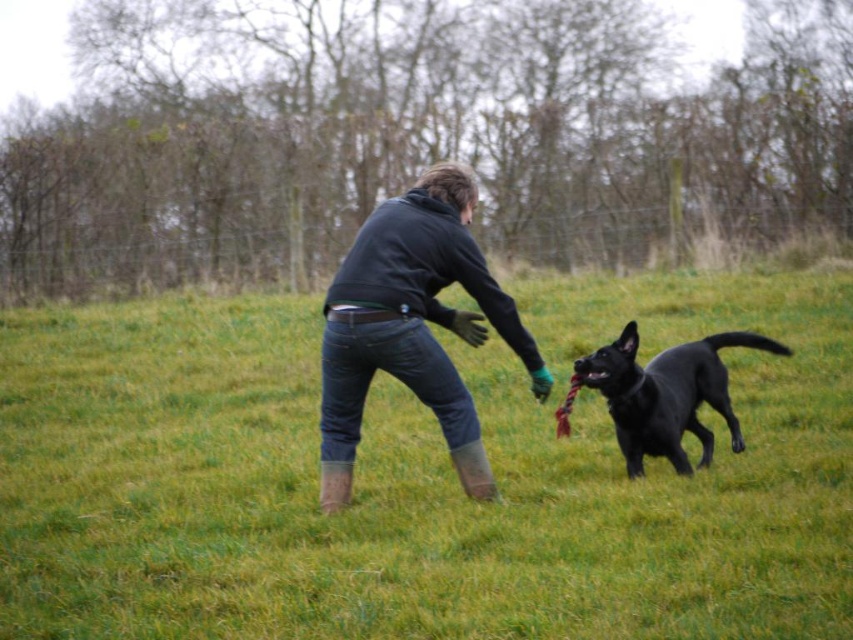
You are a photographer trying to capture the entire scene of the green grass at center and the black glossy dog at center in one shot. Given that your camera has a fixed field of view, which object would require you to adjust your framing more to ensure both are fully visible?

The black glossy dog at center requires more adjustment because the green grass at center is wider than the dog, so the camera might need to focus more on capturing the broader grass area while ensuring the dog fits within the frame.

You are a photographer trying to capture the scene. You need to focus on the green grass at center and the dark gray hoodie at center. Which object should you zoom in on to get a larger portion of the frame?

The green grass at center is bigger than the dark gray hoodie at center, so you should zoom in on the green grass at center to capture a larger portion of the frame.

You are a drone operator trying to capture a photo of the dark gray hoodie at center and the black glossy dog at center. The camera has a 30 inch field of view. Can you fit both subjects in the photo without moving the drone?

The dark gray hoodie at center and the black glossy dog at center are 33.41 inches apart from each other. Since the distance between them is greater than the 30 inch field of view, the drone cannot capture both subjects in the photo without moving.